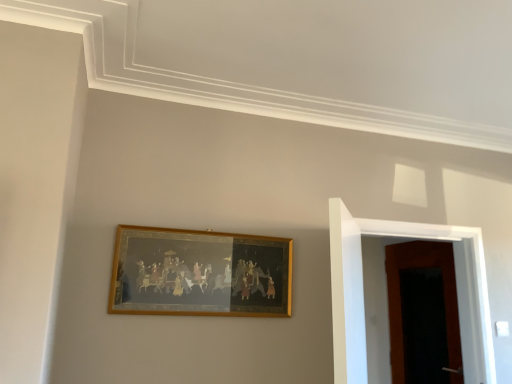
Question: From a real-world perspective, is gold-framed painting at center on wooden door at right, positioned as the first door in back-to-front order?

Choices:
 (A) no
 (B) yes

Answer: (B)

Question: From the image's perspective, is gold-framed painting at center under wooden door at right, positioned as the first door in back-to-front order?

Choices:
 (A) yes
 (B) no

Answer: (B)

Question: From the image's perspective, does gold-framed painting at center appear higher than wooden door at right, which appears as the 2th door when viewed from the front?

Choices:
 (A) no
 (B) yes

Answer: (B)

Question: Is wooden door at right, positioned as the first door in back-to-front order, completely or partially inside gold-framed painting at center?

Choices:
 (A) yes
 (B) no

Answer: (B)

Question: Does gold-framed painting at center have a smaller size compared to wooden door at right, positioned as the first door in back-to-front order?

Choices:
 (A) no
 (B) yes

Answer: (B)

Question: Does gold-framed painting at center lie in front of wooden door at right, which appears as the 2th door when viewed from the front?

Choices:
 (A) yes
 (B) no

Answer: (A)

Question: Could you tell me if wooden door at right, positioned as the first door in back-to-front order, is facing gold-framed painting at center?

Choices:
 (A) no
 (B) yes

Answer: (B)

Question: From a real-world perspective, is wooden door at right, which appears as the 2th door when viewed from the front, positioned under gold-framed painting at center based on gravity?

Choices:
 (A) no
 (B) yes

Answer: (B)

Question: From the image's perspective, is wooden door at right, positioned as the first door in back-to-front order, above gold-framed painting at center?

Choices:
 (A) no
 (B) yes

Answer: (A)

Question: Considering the relative sizes of wooden door at right, which appears as the 2th door when viewed from the front, and gold-framed painting at center in the image provided, is wooden door at right, which appears as the 2th door when viewed from the front, wider than gold-framed painting at center?

Choices:
 (A) no
 (B) yes

Answer: (A)

Question: Is wooden door at right, positioned as the first door in back-to-front order, completely or partially outside of gold-framed painting at center?

Choices:
 (A) no
 (B) yes

Answer: (B)

Question: Can you confirm if wooden door at right, which appears as the 2th door when viewed from the front, is thinner than gold-framed painting at center?

Choices:
 (A) no
 (B) yes

Answer: (B)

Question: Is wooden door at right, positioned as the first door in back-to-front order, outside of wooden door at right, which appears as the first door when viewed from the front?

Choices:
 (A) yes
 (B) no

Answer: (A)